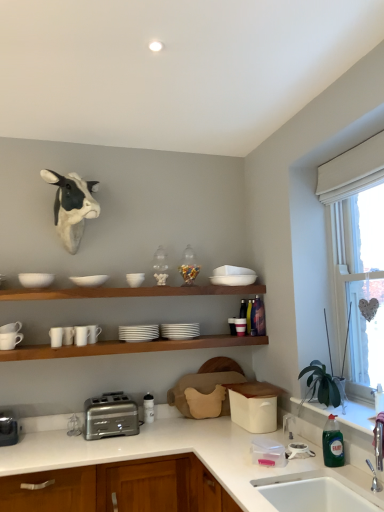
Find the location of a particular element. This screenshot has width=384, height=512. free spot to the right of white ceramic mug at left, which is the 8th tableware from right to left is located at coordinates (33, 348).